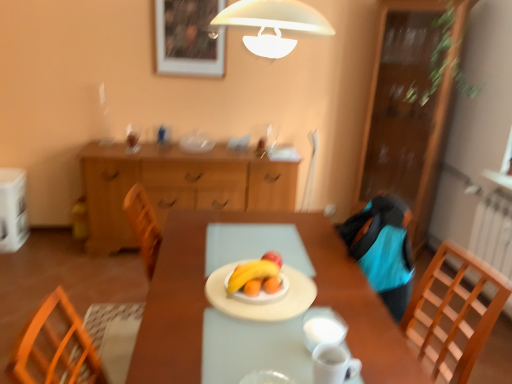
The image size is (512, 384). What are the coordinates of `empty space that is ontop of white matte plate at center, which is the fourth tableware in front-to-back order (from a real-world perspective)` in the screenshot? It's located at (273, 291).